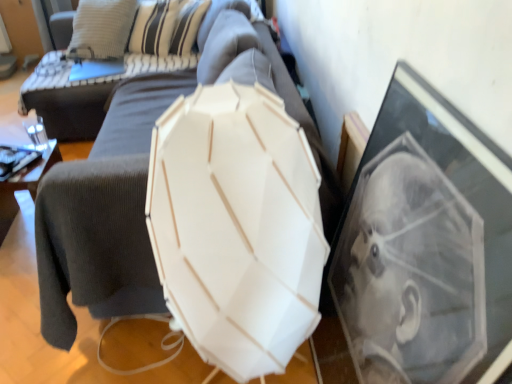
Question: Considering the relative positions of white matte lampshade at center and white matte umbrella at center in the image provided, is white matte lampshade at center behind white matte umbrella at center?

Choices:
 (A) yes
 (B) no

Answer: (A)

Question: Is white matte lampshade at center not close to white matte umbrella at center?

Choices:
 (A) no
 (B) yes

Answer: (A)

Question: From a real-world perspective, is white matte lampshade at center below white matte umbrella at center?

Choices:
 (A) yes
 (B) no

Answer: (A)

Question: Considering the relative positions of white matte lampshade at center and white matte umbrella at center in the image provided, is white matte lampshade at center to the right of white matte umbrella at center from the viewer's perspective?

Choices:
 (A) yes
 (B) no

Answer: (B)

Question: Is white matte umbrella at center at the back of white matte lampshade at center?

Choices:
 (A) yes
 (B) no

Answer: (B)

Question: From a real-world perspective, relative to dark gray fabric couch at center, is white matte umbrella at center vertically above or below?

Choices:
 (A) below
 (B) above

Answer: (B)

Question: Considering the positions of white matte umbrella at center and dark gray fabric couch at center in the image, is white matte umbrella at center wider or thinner than dark gray fabric couch at center?

Choices:
 (A) thin
 (B) wide

Answer: (A)

Question: Considering the positions of point click(263, 150) and point click(89, 135), is point click(263, 150) closer or farther from the camera than point click(89, 135)?

Choices:
 (A) closer
 (B) farther

Answer: (A)

Question: Looking at the image, does white matte umbrella at center seem bigger or smaller compared to dark gray fabric couch at center?

Choices:
 (A) big
 (B) small

Answer: (B)

Question: From the image's perspective, is white matte lampshade at center above or below white matte umbrella at center?

Choices:
 (A) above
 (B) below

Answer: (A)

Question: From a real-world perspective, relative to white matte umbrella at center, is white matte lampshade at center vertically above or below?

Choices:
 (A) below
 (B) above

Answer: (A)

Question: Looking at the image, does white matte lampshade at center seem bigger or smaller compared to white matte umbrella at center?

Choices:
 (A) big
 (B) small

Answer: (A)

Question: Would you say white matte lampshade at center is inside or outside white matte umbrella at center?

Choices:
 (A) outside
 (B) inside

Answer: (A)

Question: Considering the positions of white matte umbrella at center and white matte lampshade at center in the image, is white matte umbrella at center taller or shorter than white matte lampshade at center?

Choices:
 (A) short
 (B) tall

Answer: (B)

Question: From the image's perspective, is white matte umbrella at center located above or below white matte lampshade at center?

Choices:
 (A) above
 (B) below

Answer: (B)